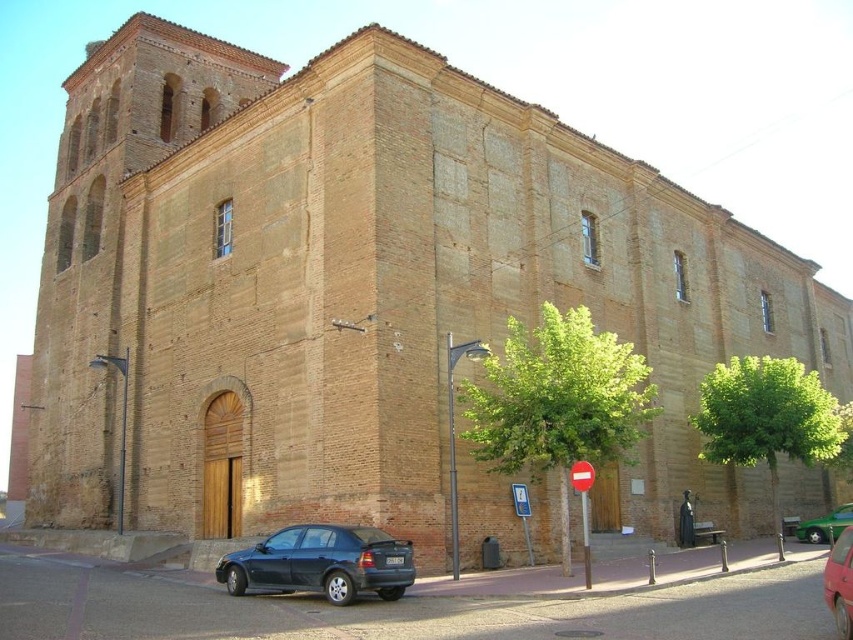
Is green leafy tree at center bigger than matte black sedan at lower left?

Correct, green leafy tree at center is larger in size than matte black sedan at lower left.

Based on the photo, is green leafy tree at center above matte black sedan at lower left?

Yes, green leafy tree at center is above matte black sedan at lower left.

This screenshot has height=640, width=853. What are the coordinates of `green leafy tree at center` in the screenshot? It's located at (556, 401).

Does green leafy tree at center appear on the right side of green glossy car at lower right?

No, green leafy tree at center is not to the right of green glossy car at lower right.

Is point (483, 451) positioned before point (822, 531)?

That is True.

At what (x,y) coordinates should I click in order to perform the action: click on green leafy tree at center. Please return your answer as a coordinate pair (x, y). Looking at the image, I should click on (556, 401).

Locate an element on the screen. green leafy tree at center is located at coordinates (556, 401).

Is point (503, 356) closer to viewer compared to point (776, 468)?

Yes, it is.

Is point (511, 452) positioned in front of point (747, 461)?

Yes, point (511, 452) is closer to viewer.

At what (x,y) coordinates should I click in order to perform the action: click on green leafy tree at center. Please return your answer as a coordinate pair (x, y). This screenshot has height=640, width=853. Looking at the image, I should click on (556, 401).